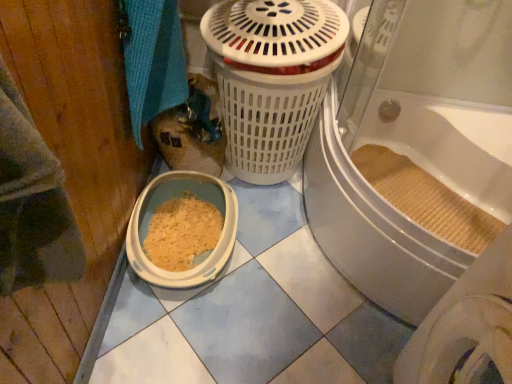
Question: Is white plastic litter box at lower left outside of beige woven mat at bathtub?

Choices:
 (A) no
 (B) yes

Answer: (B)

Question: Does white plastic litter box at lower left come behind beige woven mat at bathtub?

Choices:
 (A) yes
 (B) no

Answer: (B)

Question: From a real-world perspective, does white plastic litter box at lower left stand above beige woven mat at bathtub?

Choices:
 (A) no
 (B) yes

Answer: (A)

Question: Considering the relative sizes of white plastic litter box at lower left and beige woven mat at bathtub in the image provided, is white plastic litter box at lower left wider than beige woven mat at bathtub?

Choices:
 (A) no
 (B) yes

Answer: (B)

Question: Considering the relative sizes of white plastic litter box at lower left and beige woven mat at bathtub in the image provided, is white plastic litter box at lower left bigger than beige woven mat at bathtub?

Choices:
 (A) no
 (B) yes

Answer: (B)

Question: Is point (365, 294) closer or farther from the camera than point (138, 57)?

Choices:
 (A) closer
 (B) farther

Answer: (B)

Question: Considering their positions, is white textured bath at center located in front of or behind blue woven towel at upper left?

Choices:
 (A) behind
 (B) front

Answer: (B)

Question: Is white textured bath at center to the left or to the right of blue woven towel at upper left in the image?

Choices:
 (A) left
 (B) right

Answer: (B)

Question: Based on their sizes in the image, would you say white textured bath at center is bigger or smaller than blue woven towel at upper left?

Choices:
 (A) small
 (B) big

Answer: (B)

Question: Is beige woven mat at bathtub taller or shorter than blue woven towel at upper left?

Choices:
 (A) tall
 (B) short

Answer: (B)

Question: Which is correct: beige woven mat at bathtub is inside blue woven towel at upper left, or outside of it?

Choices:
 (A) outside
 (B) inside

Answer: (A)

Question: From a real-world perspective, relative to blue woven towel at upper left, is beige woven mat at bathtub vertically above or below?

Choices:
 (A) below
 (B) above

Answer: (A)

Question: From the image's perspective, is beige woven mat at bathtub located above or below blue woven towel at upper left?

Choices:
 (A) below
 (B) above

Answer: (A)

Question: From a real-world perspective, is blue woven towel at upper left positioned above or below white plastic litter box at lower left?

Choices:
 (A) below
 (B) above

Answer: (B)

Question: Is blue woven towel at upper left taller or shorter than white plastic litter box at lower left?

Choices:
 (A) tall
 (B) short

Answer: (A)